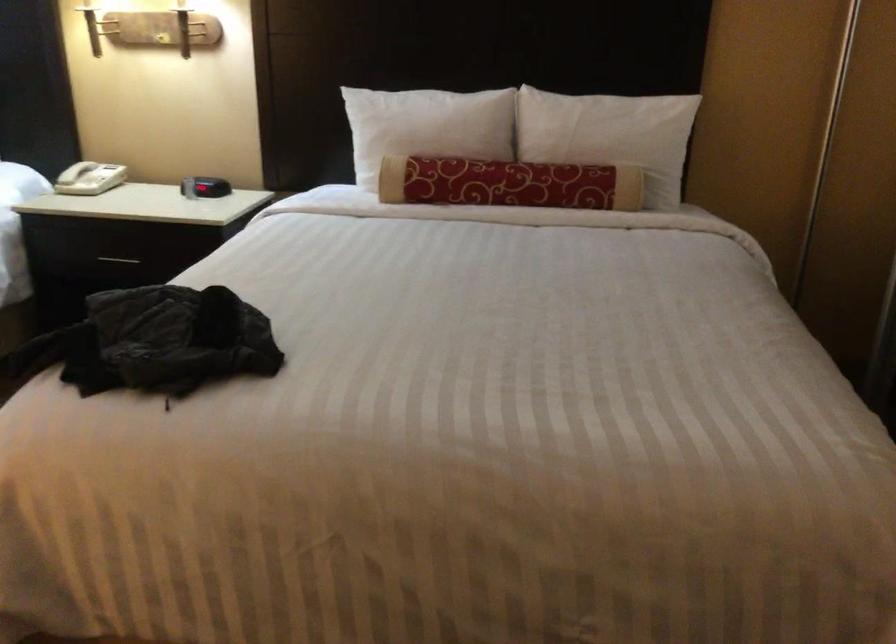
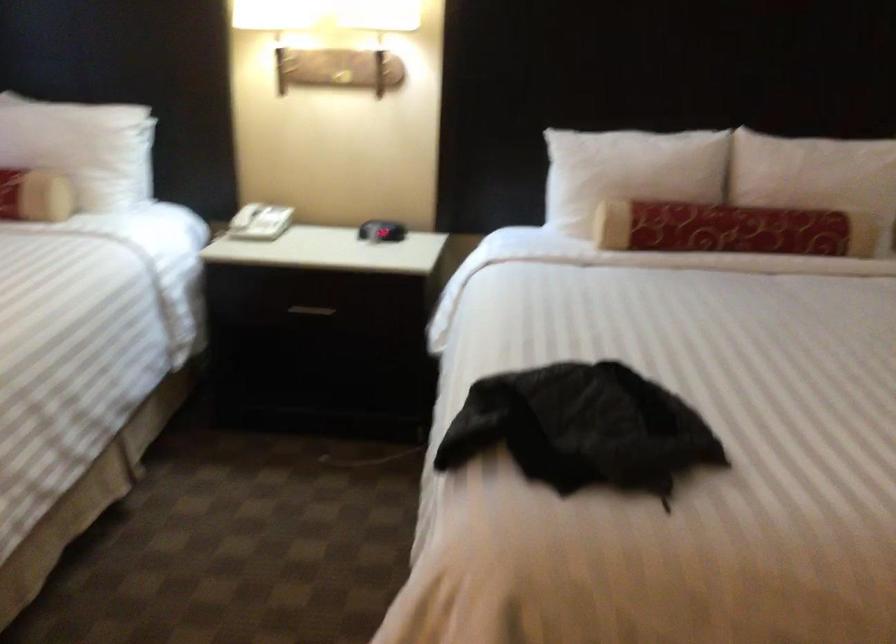
Question: Based on the continuous images, in which direction is the camera rotating? Reply with the corresponding letter.

Choices:
 (A) Left
 (B) Right
 (C) Up
 (D) Down

Answer: (C)